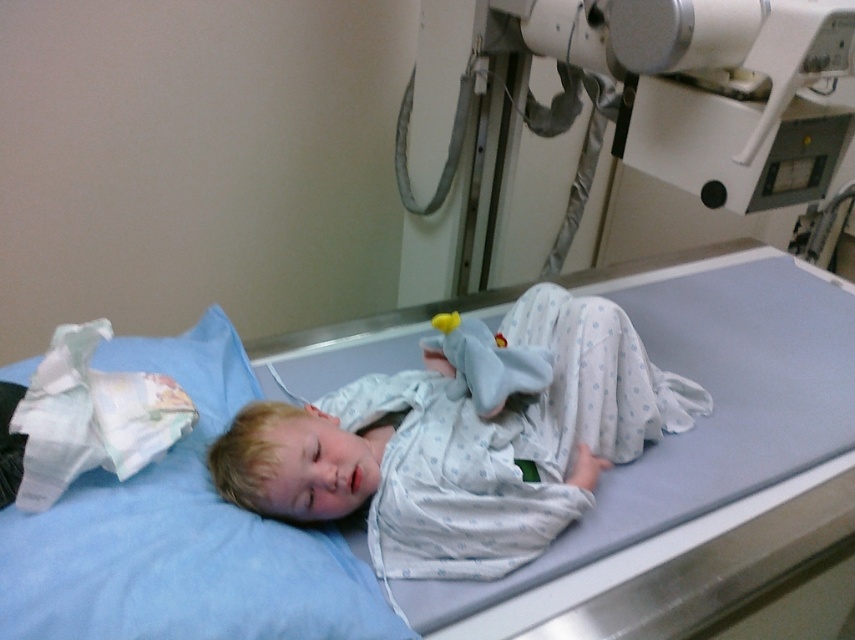
Based on the scene description, can you determine if the white cotton pajamas at center are wider than the blue fabric pillow at upper left?

The white cotton pajamas at center might be wider than blue fabric pillow at upper left according to the description.

You are a nurse checking the hospital room. You see the light blue fabric at center and the white cotton pajamas at center. Which one is larger in size?

The light blue fabric at center is bigger than the white cotton pajamas at center according to the description.

You are a nurse in the hospital and need to position a new medical device on the examination table. The device requires a clear space of 0.2 meters in front of it. Given the current setup with the metallic gray machine at upper right, can you place the device near the child without obstructing the machine?

The metallic gray machine at upper right is located at point (621, 109). Since the device requires 0.2 meters of clear space in front of it, and the machine is positioned at the upper right, placing the device near the child would likely not obstruct the machine as long as the device is placed away from the machine. However, exact placement would depend on the specific dimensions of the examination table and the device. Please ensure there is sufficient space between the device and the machine to avoid ob